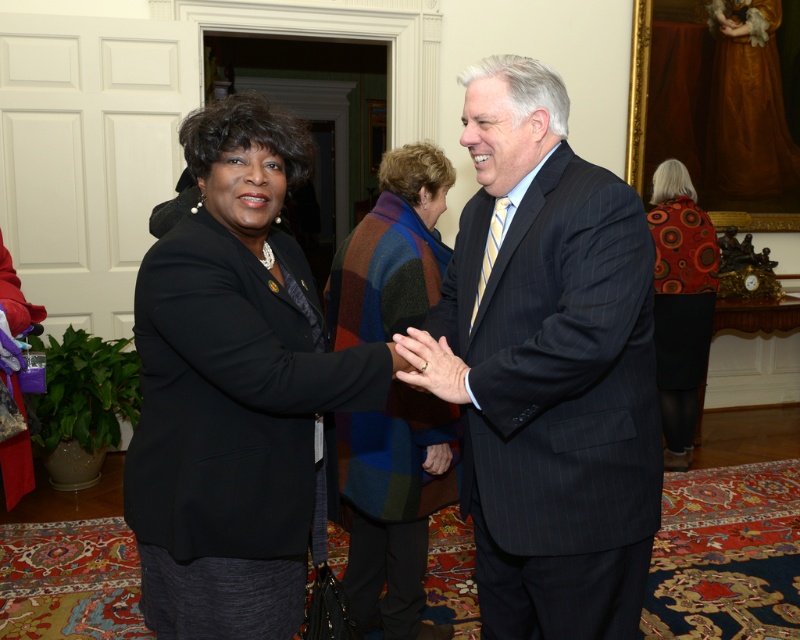
You are organizing a charity event and need to display two garments on a mannequin. The multicolored woolen shawl at center and the orange patterned sweater at right must be placed on a single mannequin. Which garment should be placed on top to ensure visibility of both items?

The multicolored woolen shawl at center should be placed on top because it has a larger size compared to the orange patterned sweater at right, allowing both garments to be visible.

You are organizing a charity event and need to arrange these items for a photo shoot. The photographer wants the multicolored woolen shawl at center and orange patterned sweater at right to be visible in the frame. Given their positions, which item should you adjust to ensure both are in the shot?

The multicolored woolen shawl at center is located below the orange patterned sweater at right. To ensure both are visible, you should adjust the angle or position of the camera to capture the lower area where the shawl is placed while keeping the sweater in the upper right part of the frame.